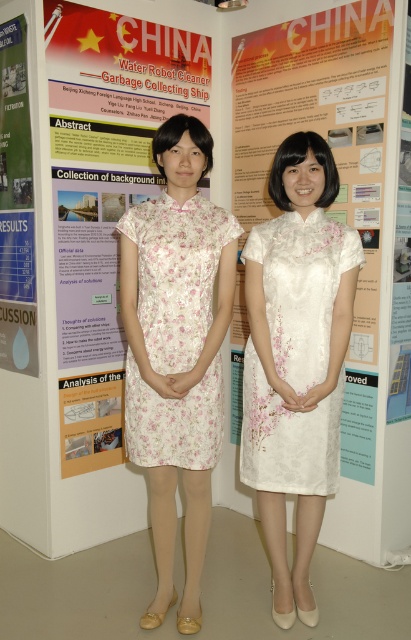
You are an attendee at the presentation. You see the white floral dress at center and the white paper poster at center. Which one is more to the right?

The white floral dress at center is positioned on the right side of the white paper poster at center, so the white floral dress at center is more to the right.

You are standing in front of the poster board titled CHINA Water Robot Cleaner Garbage Collecting Ship. There are two points marked on the poster. The first point is at coordinate point (336, 474) and the second point is at coordinate point (122, 371). Which point is closer to you?

Point (336, 474) is closer to the camera than point (122, 371).

You are an event photographer at a presentation. You need to capture a photo that includes both the floral satin dress at center and the blue glossy poster at left. Considering their sizes, which object should you focus on to ensure both are clearly visible in the frame?

The floral satin dress at center is larger in size than the blue glossy poster at left, so focusing on the floral satin dress at center would help ensure both are clearly visible in the frame since it takes up more space and can anchor the composition.